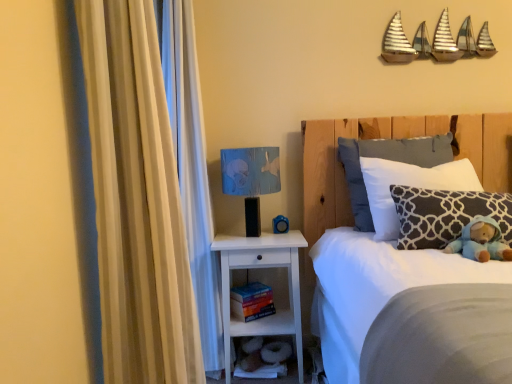
What do you see at coordinates (251, 179) in the screenshot? I see `blue fabric lampshade at upper right` at bounding box center [251, 179].

This screenshot has width=512, height=384. What do you see at coordinates (389, 137) in the screenshot? I see `white soft bed at upper right` at bounding box center [389, 137].

What do you see at coordinates (409, 185) in the screenshot? This screenshot has width=512, height=384. I see `dark gray textured pillow at upper right, the second pillow when ordered from front to back` at bounding box center [409, 185].

What is the approximate width of dark gray patterned pillow at right, the 3th pillow in the back-to-front sequence?

It is 8.68 inches.

What do you see at coordinates (446, 215) in the screenshot?
I see `dark gray patterned pillow at right, the 3th pillow in the back-to-front sequence` at bounding box center [446, 215].

What do you see at coordinates (256, 268) in the screenshot? I see `white wood nightstand at lower center` at bounding box center [256, 268].

You are a GUI agent. You are given a task and a screenshot of the screen. Output one action in this format:
    pyautogui.click(x=<x>, y=<y>)
    Task: Click on the blue fabric lampshade at upper right
    The height and width of the screenshot is (384, 512).
    Given the screenshot: What is the action you would take?
    pyautogui.click(x=251, y=179)

From the image's perspective, relative to white soft bed at upper right, is blue plush toy at right above or below?

blue plush toy at right is situated higher than white soft bed at upper right in the image.

I want to click on doll above the white soft bed at upper right (from the image's perspective), so click(x=481, y=241).

Does blue plush toy at right appear on the right side of white soft bed at upper right?

In fact, blue plush toy at right is to the left of white soft bed at upper right.

Is blue plush toy at right in contact with white soft bed at upper right?

No, blue plush toy at right is not making contact with white soft bed at upper right.

Does beige fabric curtain at left appear on the right side of white wood nightstand at lower center?

Incorrect, beige fabric curtain at left is not on the right side of white wood nightstand at lower center.

Consider the image. Is beige fabric curtain at left oriented towards white wood nightstand at lower center?

No, beige fabric curtain at left does not turn towards white wood nightstand at lower center.

Is beige fabric curtain at left bigger or smaller than white wood nightstand at lower center?

beige fabric curtain at left is smaller than white wood nightstand at lower center.

Is dark gray patterned pillow at right, the 3th pillow in the back-to-front sequence, next to white wood nightstand at lower center?

dark gray patterned pillow at right, the 3th pillow in the back-to-front sequence, is not next to white wood nightstand at lower center, and they're not touching.

From the image's perspective, which one is positioned lower, dark gray patterned pillow at right, the 3th pillow in the back-to-front sequence, or white wood nightstand at lower center?

From the image's view, white wood nightstand at lower center is below.

Who is bigger, dark gray patterned pillow at right, placed as the first pillow when sorted from front to back, or white wood nightstand at lower center?

white wood nightstand at lower center is bigger.

Is dark gray patterned pillow at right, the 3th pillow in the back-to-front sequence, taller than white wood nightstand at lower center?

No.

Can you tell me how much hardcover book at lower center and dark gray patterned pillow at right, the 3th pillow in the back-to-front sequence, differ in facing direction?

The angular difference between hardcover book at lower center and dark gray patterned pillow at right, the 3th pillow in the back-to-front sequence, is 32.8 degrees.

From the image's perspective, is hardcover book at lower center positioned above or below dark gray patterned pillow at right, placed as the first pillow when sorted from front to back?

From the image's perspective, hardcover book at lower center appears below dark gray patterned pillow at right, placed as the first pillow when sorted from front to back.

Would you say hardcover book at lower center is to the left or to the right of dark gray patterned pillow at right, the 3th pillow in the back-to-front sequence, in the picture?

hardcover book at lower center is positioned on dark gray patterned pillow at right, the 3th pillow in the back-to-front sequence,'s left side.

Who is bigger, hardcover book at lower center or dark gray patterned pillow at right, placed as the first pillow when sorted from front to back?

With larger size is dark gray patterned pillow at right, placed as the first pillow when sorted from front to back.

Looking at their sizes, would you say blue fabric lampshade at upper right is wider or thinner than white soft bed at upper right?

Clearly, blue fabric lampshade at upper right has less width compared to white soft bed at upper right.

From the image's perspective, is blue fabric lampshade at upper right under white soft bed at upper right?

No, from the image's perspective, blue fabric lampshade at upper right is not below white soft bed at upper right.

Is blue fabric lampshade at upper right bigger than white soft bed at upper right?

Incorrect, blue fabric lampshade at upper right is not larger than white soft bed at upper right.

Is hardcover book at lower center in contact with white wood nightstand at lower center?

hardcover book at lower center and white wood nightstand at lower center are clearly separated.

Choose the correct answer: Is hardcover book at lower center inside white wood nightstand at lower center or outside it?

hardcover book at lower center fits inside white wood nightstand at lower center.

Considering the relative sizes of hardcover book at lower center and white wood nightstand at lower center in the image provided, is hardcover book at lower center taller than white wood nightstand at lower center?

No.

I want to click on nightstand in front of the hardcover book at lower center, so pyautogui.click(x=256, y=268).

Considering the relative positions of beige fabric curtain at left and blue fabric lampshade at upper right in the image provided, is beige fabric curtain at left to the right of blue fabric lampshade at upper right from the viewer's perspective?

Incorrect, beige fabric curtain at left is not on the right side of blue fabric lampshade at upper right.

Which of these two, beige fabric curtain at left or blue fabric lampshade at upper right, is bigger?

beige fabric curtain at left is bigger.

From the picture: Between beige fabric curtain at left and blue fabric lampshade at upper right, which one has more height?

Standing taller between the two is beige fabric curtain at left.

Looking at their sizes, would you say beige fabric curtain at left is wider or thinner than blue fabric lampshade at upper right?

In the image, beige fabric curtain at left appears to be more narrow than blue fabric lampshade at upper right.

The height and width of the screenshot is (384, 512). What are the coordinates of `doll on the left of white soft bed at upper right` in the screenshot? It's located at (481, 241).

The image size is (512, 384). In the image, there is a beige fabric curtain at left. Identify the location of nightstand below it (from a real-world perspective). (256, 268).

Considering their positions, is white wood nightstand at lower center positioned closer to blue plush toy at right than hardcover book at lower center?

The object closer to blue plush toy at right is white wood nightstand at lower center.

Considering their positions, is white soft bed at upper right positioned closer to blue rubber duck at lower center than dark gray textured pillow at upper right, which appears as the 2th pillow when viewed from the back?

Based on the image, white soft bed at upper right appears to be nearer to blue rubber duck at lower center.

Considering their positions, is white fabric pillow at upper right, which is counted as the third pillow, starting from the front, positioned further to dark gray textured pillow at upper right, the second pillow when ordered from front to back, than blue fabric lampshade at upper right?

The object further to dark gray textured pillow at upper right, the second pillow when ordered from front to back, is blue fabric lampshade at upper right.

Based on their spatial positions, is white wood nightstand at lower center or blue plush toy at right further from blue fabric lampshade at upper right?

Among the two, blue plush toy at right is located further to blue fabric lampshade at upper right.

From the picture: Based on their spatial positions, is blue rubber duck at lower center or white soft bed at upper right closer to blue plush toy at right?

white soft bed at upper right.

Consider the image. When comparing their distances from dark gray textured pillow at upper right, which appears as the 2th pillow when viewed from the back, does blue rubber duck at lower center or dark gray patterned pillow at right, placed as the first pillow when sorted from front to back, seem further?

The object further to dark gray textured pillow at upper right, which appears as the 2th pillow when viewed from the back, is blue rubber duck at lower center.

Estimate the real-world distances between objects in this image. Which object is further from dark gray patterned pillow at right, placed as the first pillow when sorted from front to back, beige fabric curtain at left or white fabric pillow at upper right, which is counted as the third pillow, starting from the front?

Based on the image, beige fabric curtain at left appears to be further to dark gray patterned pillow at right, placed as the first pillow when sorted from front to back.

Looking at the image, which one is located closer to white soft bed at upper right, white wood nightstand at lower center or blue fabric lampshade at upper right?

blue fabric lampshade at upper right.

Identify the location of table lamp between white soft bed at upper right and hardcover book at lower center along the z-axis. This screenshot has width=512, height=384. (251, 179).

You are a GUI agent. You are given a task and a screenshot of the screen. Output one action in this format:
    pyautogui.click(x=<x>, y=<y>)
    Task: Click on the nightstand situated between hardcover book at lower center and blue plush toy at right from left to right
    The height and width of the screenshot is (384, 512).
    Given the screenshot: What is the action you would take?
    pyautogui.click(x=256, y=268)

At what (x,y) coordinates should I click in order to perform the action: click on table lamp positioned between beige fabric curtain at left and blue rubber duck at lower center from near to far. Please return your answer as a coordinate pair (x, y). The height and width of the screenshot is (384, 512). Looking at the image, I should click on (251, 179).

This screenshot has width=512, height=384. I want to click on doll between white soft bed at upper right and white fabric pillow at upper right, which is counted as the third pillow, starting from the front, in the front-back direction, so click(x=481, y=241).